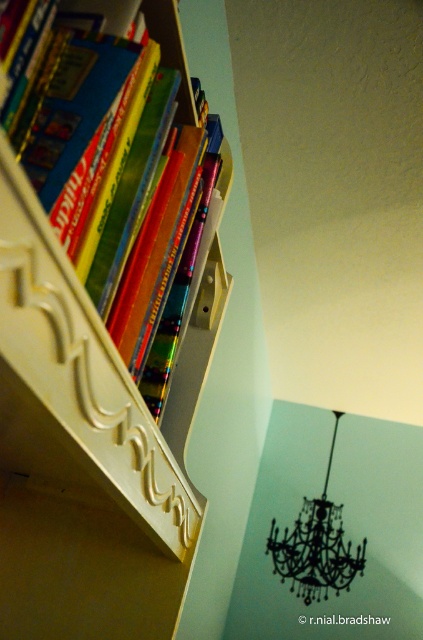
Does matte blue book at left appear over white carved wood drawer at upper left?

Yes.

Can you confirm if matte blue book at left is thinner than white carved wood drawer at upper left?

Indeed, matte blue book at left has a lesser width compared to white carved wood drawer at upper left.

Which is behind, point (82, 209) or point (156, 486)?

Positioned behind is point (156, 486).

Identify the location of matte blue book at left. (118, 166).

From the picture: Between white carved wood drawer at upper left and black crystal chandelier at upper center, which one is positioned higher?

white carved wood drawer at upper left

Does white carved wood drawer at upper left have a greater width compared to black crystal chandelier at upper center?

Incorrect, white carved wood drawer at upper left's width does not surpass black crystal chandelier at upper center's.

Which is behind, point (60, 307) or point (294, 582)?

Positioned behind is point (294, 582).

Where is `white carved wood drawer at upper left`? This screenshot has height=640, width=423. white carved wood drawer at upper left is located at coordinates (82, 371).

Based on the photo, which of these two, matte blue book at left or black crystal chandelier at upper center, stands taller?

Standing taller between the two is black crystal chandelier at upper center.

Is matte blue book at left thinner than black crystal chandelier at upper center?

Yes, matte blue book at left is thinner than black crystal chandelier at upper center.

You are a GUI agent. You are given a task and a screenshot of the screen. Output one action in this format:
    pyautogui.click(x=<x>, y=<y>)
    Task: Click on the matte blue book at left
    
    Given the screenshot: What is the action you would take?
    pyautogui.click(x=118, y=166)

Locate an element on the screen. matte blue book at left is located at coordinates (118, 166).